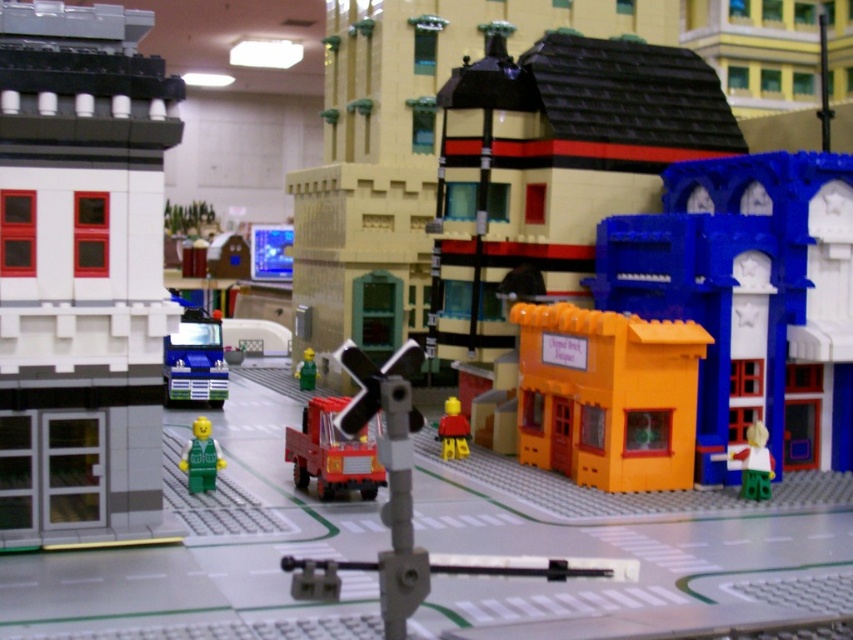
Question: Which object is the farthest from the green matte figure at center?

Choices:
 (A) white matte building at left
 (B) blue plastic truck at center
 (C) shiny red fire truck at center

Answer: (A)

Question: Among these points, which one is farthest from the camera?

Choices:
 (A) (200, 492)
 (B) (47, 253)
 (C) (643, 392)

Answer: (C)

Question: Is green matte minifigure at center further to camera compared to green matte figure at center?

Choices:
 (A) no
 (B) yes

Answer: (A)

Question: Is blue plastic truck at center below green matte minifigure at center?

Choices:
 (A) yes
 (B) no

Answer: (B)

Question: Is the position of orange matte building at center less distant than that of shiny red fire truck at center?

Choices:
 (A) no
 (B) yes

Answer: (A)

Question: Which is farther from the white matte building at left?

Choices:
 (A) orange matte building at center
 (B) green matte figure at center
 (C) shiny red fire truck at center

Answer: (B)